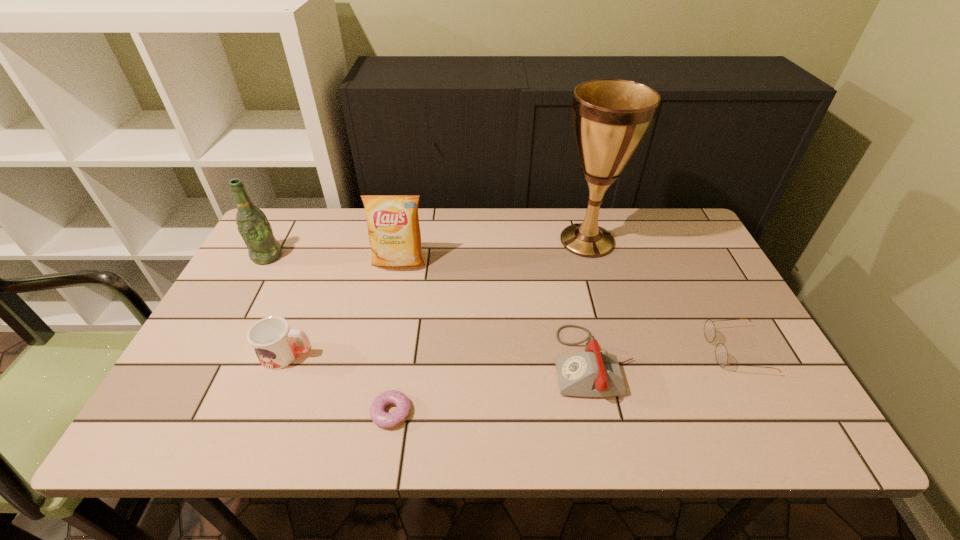
Locate an element on the screen. vacant space at the far edge of the desktop is located at coordinates (319, 253).

Identify the location of blank area at the near edge. (269, 411).

Where is `free space at the left edge`? Image resolution: width=960 pixels, height=540 pixels. free space at the left edge is located at coordinates (257, 362).

The height and width of the screenshot is (540, 960). What are the coordinates of `vacant position at the right edge of the desktop` in the screenshot? It's located at (687, 273).

Image resolution: width=960 pixels, height=540 pixels. I want to click on vacant area at the far right corner, so click(x=660, y=213).

Locate an element on the screen. The width and height of the screenshot is (960, 540). blank region between the telephone and the tallest object is located at coordinates (590, 301).

The image size is (960, 540). What are the coordinates of `vacant space in between the tallest object and the telephone` in the screenshot? It's located at (590, 301).

Where is `free point between the telephone and the rightmost object`? This screenshot has height=540, width=960. free point between the telephone and the rightmost object is located at coordinates (664, 356).

Where is `free space that is in between the crisp (potato chip) and the rightmost object`? free space that is in between the crisp (potato chip) and the rightmost object is located at coordinates (x=567, y=306).

You are a GUI agent. You are given a task and a screenshot of the screen. Output one action in this format:
    pyautogui.click(x=<x>, y=<y>)
    Task: Click on the free space between the tallest object and the crisp (potato chip)
    The width and height of the screenshot is (960, 540).
    Given the screenshot: What is the action you would take?
    pyautogui.click(x=492, y=252)